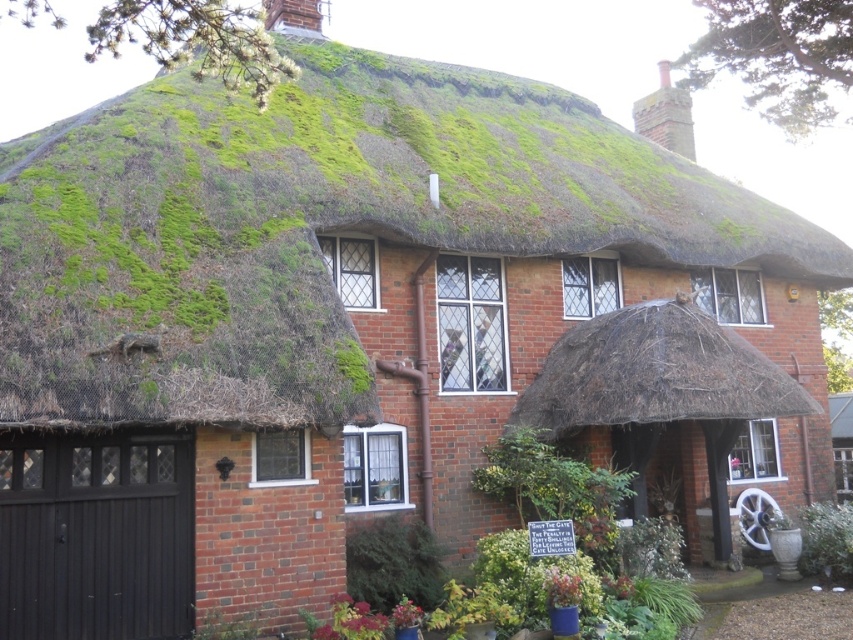
Is brown thatch roof at center bigger than green leafy plant at lower right?

Yes.

Does brown thatch roof at center appear on the right side of green leafy plant at lower right?

In fact, brown thatch roof at center is to the left of green leafy plant at lower right.

This screenshot has width=853, height=640. Describe the element at coordinates (656, 376) in the screenshot. I see `brown thatch roof at center` at that location.

Identify the location of brown thatch roof at center. The width and height of the screenshot is (853, 640). (656, 376).